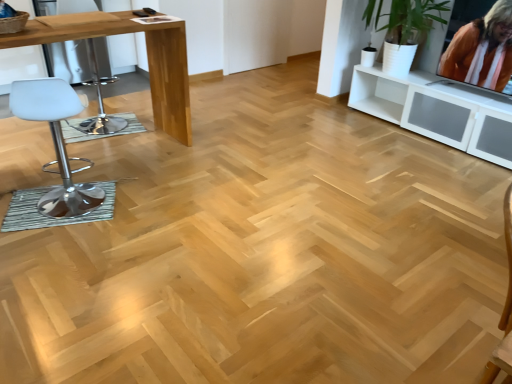
Where is `light brown glossy table at left`? The height and width of the screenshot is (384, 512). light brown glossy table at left is located at coordinates (148, 58).

Image resolution: width=512 pixels, height=384 pixels. What are the coordinates of `orange fabric at upper right` in the screenshot? It's located at [x=482, y=50].

Locate an element on the screen. This screenshot has width=512, height=384. white plastic swivel chair at left is located at coordinates (87, 80).

Image resolution: width=512 pixels, height=384 pixels. I want to click on swivel chair that appears below the orange fabric at upper right (from a real-world perspective), so click(87, 80).

Would you say white plastic swivel chair at left is part of orange fabric at upper right's contents?

No, white plastic swivel chair at left is not inside orange fabric at upper right.

From the image's perspective, is orange fabric at upper right under white plastic swivel chair at left?

No, from the image's perspective, orange fabric at upper right is not beneath white plastic swivel chair at left.

Is orange fabric at upper right beside white plastic swivel chair at left?

No, orange fabric at upper right is not touching white plastic swivel chair at left.

Which of these two, white plastic swivel chair at left or white leather stool at left, is thinner?

white leather stool at left is thinner.

Is point (75, 81) behind point (53, 213)?

Yes, it is behind point (53, 213).

Is white plastic swivel chair at left far from white leather stool at left?

That's right, there is a large distance between white plastic swivel chair at left and white leather stool at left.

In the image, there is a white plastic swivel chair at left. At what (x,y) coordinates should I click in order to perform the action: click on chair below it (from a real-world perspective). Please return your answer as a coordinate pair (x, y). The width and height of the screenshot is (512, 384). Looking at the image, I should click on (56, 143).

Does point (500, 27) lie in front of point (73, 34)?

That is False.

From a real-world perspective, which is physically below, orange fabric at upper right or light brown glossy table at left?

light brown glossy table at left, from a real-world perspective.

Is orange fabric at upper right aimed at light brown glossy table at left?

No, orange fabric at upper right is not facing towards light brown glossy table at left.

Is orange fabric at upper right far away from light brown glossy table at left?

Yes.

Would you say light brown glossy table at left is to the left or to the right of orange fabric at upper right in the picture?

light brown glossy table at left is positioned on orange fabric at upper right's left side.

Is light brown glossy table at left wider or thinner than orange fabric at upper right?

Clearly, light brown glossy table at left has more width compared to orange fabric at upper right.

In the scene shown: Is light brown glossy table at left closer to the viewer compared to orange fabric at upper right?

That is True.

What's the angular difference between light brown glossy table at left and white plastic swivel chair at left's facing directions?

167 degrees.

Consider the image. From the image's perspective, is light brown glossy table at left located above white plastic swivel chair at left?

Actually, light brown glossy table at left appears below white plastic swivel chair at left in the image.

Considering their positions, is light brown glossy table at left located in front of or behind white plastic swivel chair at left?

Visually, light brown glossy table at left is located in front of white plastic swivel chair at left.

Considering the sizes of objects light brown glossy table at left and white plastic swivel chair at left in the image provided, who is thinner, light brown glossy table at left or white plastic swivel chair at left?

Thinner between the two is white plastic swivel chair at left.

The height and width of the screenshot is (384, 512). I want to click on person above the white plastic swivel chair at left (from the image's perspective), so click(482, 50).

Which of these two, white plastic swivel chair at left or orange fabric at upper right, is bigger?

Bigger between the two is white plastic swivel chair at left.

From the image's perspective, is white plastic swivel chair at left located beneath orange fabric at upper right?

Correct, white plastic swivel chair at left appears lower than orange fabric at upper right in the image.

Does white plastic swivel chair at left have a greater height compared to orange fabric at upper right?

Correct, white plastic swivel chair at left is much taller as orange fabric at upper right.

Can you see white leather stool at left touching light brown glossy table at left?

No, white leather stool at left is not making contact with light brown glossy table at left.

Which object is further away from the camera, white leather stool at left or light brown glossy table at left?

light brown glossy table at left is behind.

From the image's perspective, which object appears higher, white leather stool at left or light brown glossy table at left?

light brown glossy table at left, from the image's perspective.

In order to click on swivel chair behind the orange fabric at upper right in this screenshot , I will do `click(87, 80)`.

At what (x,y) coordinates should I click in order to perform the action: click on chair below the white plastic swivel chair at left (from the image's perspective). Please return your answer as a coordinate pair (x, y). This screenshot has height=384, width=512. Looking at the image, I should click on (56, 143).

Estimate the real-world distances between objects in this image. Which object is closer to orange fabric at upper right, white plastic swivel chair at left or white leather stool at left?

Among the two, white leather stool at left is located nearer to orange fabric at upper right.

Estimate the real-world distances between objects in this image. Which object is further from white plastic swivel chair at left, orange fabric at upper right or white leather stool at left?

Based on the image, orange fabric at upper right appears to be further to white plastic swivel chair at left.

Looking at the image, which one is located further to white plastic swivel chair at left, white leather stool at left or orange fabric at upper right?

orange fabric at upper right lies further to white plastic swivel chair at left than the other object.

Looking at this image, when comparing their distances from orange fabric at upper right, does light brown glossy table at left or white leather stool at left seem further?

Based on the image, white leather stool at left appears to be further to orange fabric at upper right.

Which object lies nearer to the anchor point light brown glossy table at left, white plastic swivel chair at left or orange fabric at upper right?

Based on the image, white plastic swivel chair at left appears to be nearer to light brown glossy table at left.

When comparing their distances from white leather stool at left, does orange fabric at upper right or white plastic swivel chair at left seem further?

The object further to white leather stool at left is orange fabric at upper right.

Looking at the image, which one is located closer to orange fabric at upper right, white plastic swivel chair at left or light brown glossy table at left?

light brown glossy table at left is positioned closer to the anchor orange fabric at upper right.

From the image, which object appears to be nearer to white leather stool at left, light brown glossy table at left or white plastic swivel chair at left?

light brown glossy table at left lies closer to white leather stool at left than the other object.

You are a GUI agent. You are given a task and a screenshot of the screen. Output one action in this format:
    pyautogui.click(x=<x>, y=<y>)
    Task: Click on the chair between light brown glossy table at left and orange fabric at upper right from left to right
    
    Given the screenshot: What is the action you would take?
    click(x=56, y=143)

I want to click on table between white leather stool at left and white plastic swivel chair at left along the z-axis, so click(x=148, y=58).

This screenshot has height=384, width=512. I want to click on chair between white plastic swivel chair at left and orange fabric at upper right in the horizontal direction, so click(x=56, y=143).

Where is `table between white plastic swivel chair at left and orange fabric at upper right from left to right`? table between white plastic swivel chair at left and orange fabric at upper right from left to right is located at coordinates (148, 58).